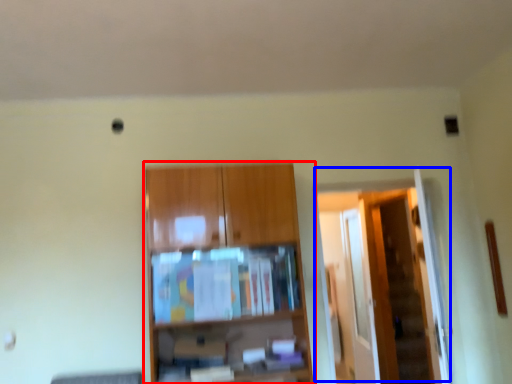
Question: Which object appears closest to the camera in this image, cupboard (highlighted by a red box) or door (highlighted by a blue box)?

Choices:
 (A) cupboard
 (B) door

Answer: (A)